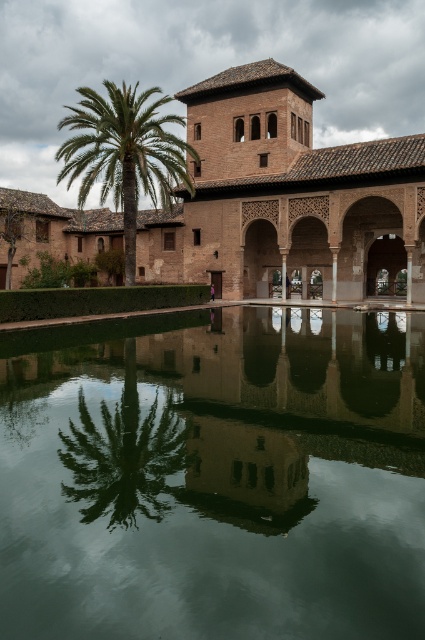
Consider the image. You are standing in the courtyard and want to take a photo of the green reflective water at center. If your camera is 4.34 meters away from the water, is it possible to capture the entire structure reflected in the water without moving closer?

The green reflective water at center and camera are 4.34 meters apart from each other. Since the camera is exactly at that distance, it is possible to capture the entire structure reflected in the water without moving closer, provided the camera has a wide enough lens to encompass the reflection.

You are standing in the courtyard and want to take a photo of both the brown clay palace at center and the green leafy palm at center. Which object should you position closer to the left side of the camera frame to include both in the shot?

The green leafy palm at center should be positioned closer to the left side of the camera frame because the brown clay palace at center is to the right of it, so placing the palm to the left ensures both are included in the shot.

Consider the image. You are standing in the courtyard and want to walk from point A to point B. Point A is located at coordinate point (254, 179) and point B is at coordinate point (102, 115). Which direction should you move to get from point A to point B?

To move from point A at coordinate (254, 179) to point B at coordinate (102, 115), you should move towards the lower left direction since point B is closer to the viewer and positioned lower and to the left compared to point A.